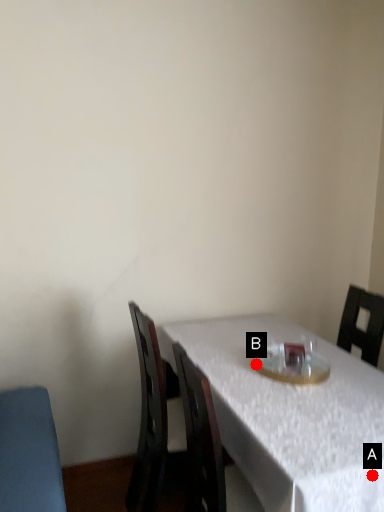
Question: Two points are circled on the image, labeled by A and B beside each circle. Which point appears closest to the camera in this image?

Choices:
 (A) A is closer
 (B) B is closer

Answer: (A)